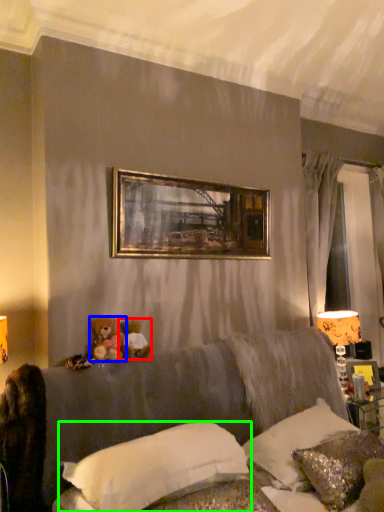
Question: Which object is positioned closest to toy (highlighted by a red box)? Select from toy (highlighted by a blue box) and pillow (highlighted by a green box).

Choices:
 (A) toy
 (B) pillow

Answer: (A)